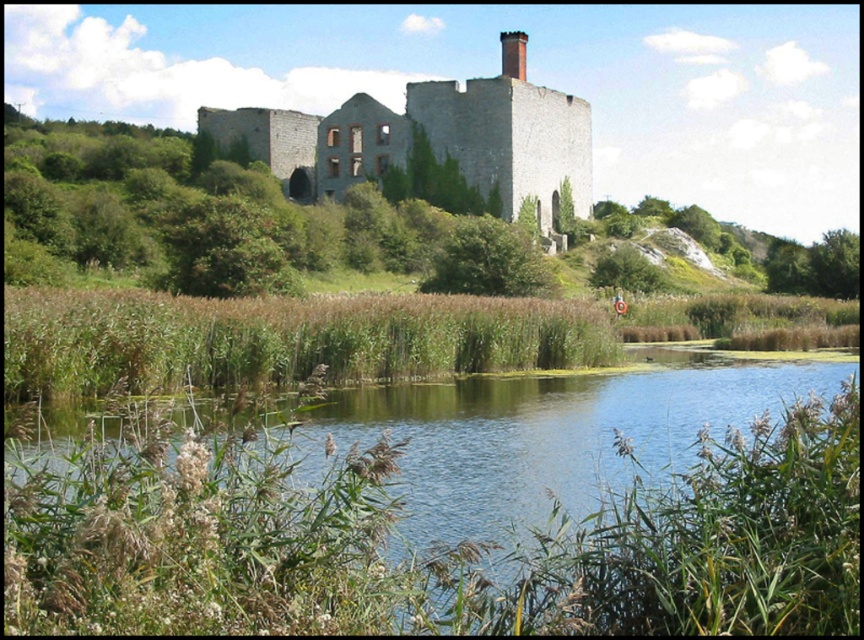
You are standing at the edge of the green grassy river at center and want to reach the gray stone castle at center. Which direction should you move to get closer to the castle?

You should move backward because the green grassy river at center is in front of the gray stone castle at center, meaning the castle is behind you relative to your current position.

You are standing at the base of the hill near the water. You want to reach the point marked at coordinates point (217, 496). Considering the terrain, which direction should you head to get there?

The point (217, 496) is 136.54 feet away from you, so you should head towards the direction of the dilapidated stone structure atop the hill to reach it.

You are standing at the point marked as point (426, 547) in the image. Based on the scene description, what type of terrain are you currently standing on?

The point (426, 547) is located on the green grassy river at center, so you are standing on grassy terrain.